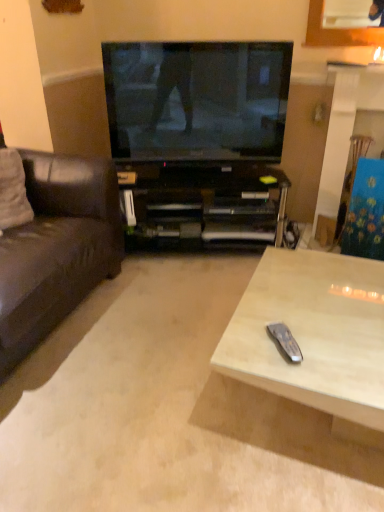
Identify the location of vacant area that is situated to the right of silver metallic remote at lower right. (332, 350).